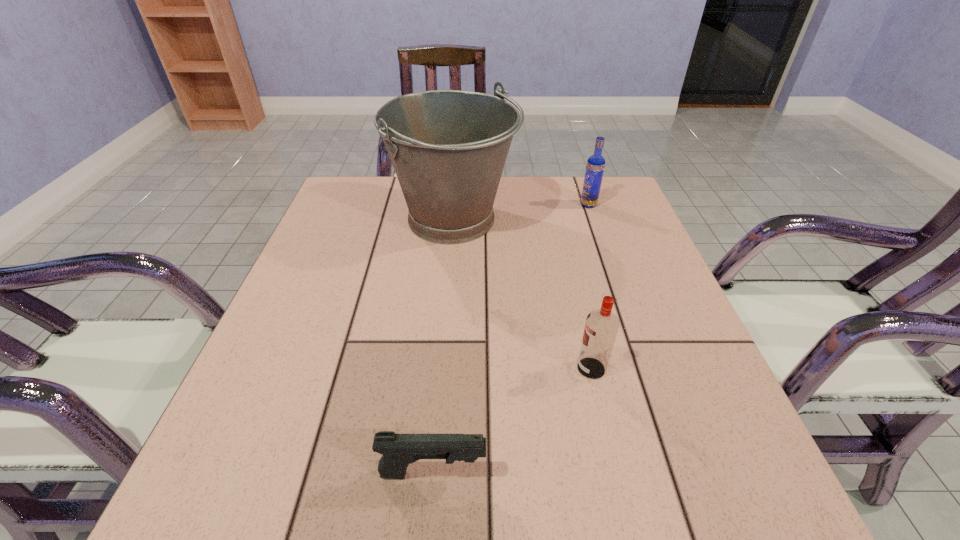
The height and width of the screenshot is (540, 960). I want to click on vacant space at the left edge of the desktop, so click(x=271, y=427).

In the image, there is a desktop. At what (x,y) coordinates should I click in order to perform the action: click on free space at the right edge. Please return your answer as a coordinate pair (x, y). The height and width of the screenshot is (540, 960). Looking at the image, I should click on click(x=700, y=395).

Locate an element on the screen. vacant region at the far left corner of the desktop is located at coordinates (373, 177).

You are a GUI agent. You are given a task and a screenshot of the screen. Output one action in this format:
    pyautogui.click(x=<x>, y=<y>)
    Task: Click on the vacant space at the far right corner of the desktop
    This screenshot has width=960, height=540.
    Given the screenshot: What is the action you would take?
    pyautogui.click(x=603, y=208)

Where is `free space between the pistol and the tallest object`? free space between the pistol and the tallest object is located at coordinates (444, 346).

You are a GUI agent. You are given a task and a screenshot of the screen. Output one action in this format:
    pyautogui.click(x=<x>, y=<y>)
    Task: Click on the vacant space in between the tallest object and the shortest object
    
    Given the screenshot: What is the action you would take?
    pyautogui.click(x=444, y=346)

At what (x,y) coordinates should I click in order to perform the action: click on free spot between the right vodka and the tallest object. Please return your answer as a coordinate pair (x, y). The image size is (960, 540). Looking at the image, I should click on (521, 212).

This screenshot has height=540, width=960. In order to click on vacant region between the left vodka and the pistol in this screenshot , I will do `click(512, 421)`.

Locate an element on the screen. The width and height of the screenshot is (960, 540). vacant space that is in between the third farthest object and the pistol is located at coordinates (x=512, y=421).

Where is `free space between the pistol and the nearer vodka`? Image resolution: width=960 pixels, height=540 pixels. free space between the pistol and the nearer vodka is located at coordinates [x=512, y=421].